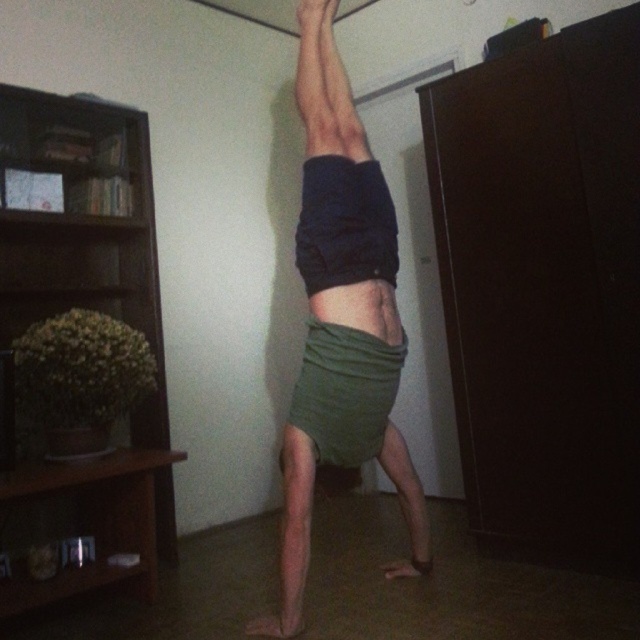
Question: Which point is farther from the camera taking this photo?

Choices:
 (A) (380, 296)
 (B) (124, 154)

Answer: (B)

Question: Which point is closer to the camera taking this photo?

Choices:
 (A) (390, 442)
 (B) (168, 451)

Answer: (A)

Question: Does brown wooden bookshelf at left appear on the left side of green fabric shorts at center?

Choices:
 (A) no
 (B) yes

Answer: (B)

Question: Which object appears farthest from the camera in this image?

Choices:
 (A) green fabric muscle at center
 (B) green fabric shorts at center
 (C) brown wooden bookshelf at left

Answer: (A)

Question: Can you confirm if green fabric shorts at center is positioned to the left of green fabric muscle at center?

Choices:
 (A) no
 (B) yes

Answer: (B)

Question: Is brown wooden bookshelf at left positioned at the back of green fabric shorts at center?

Choices:
 (A) yes
 (B) no

Answer: (B)